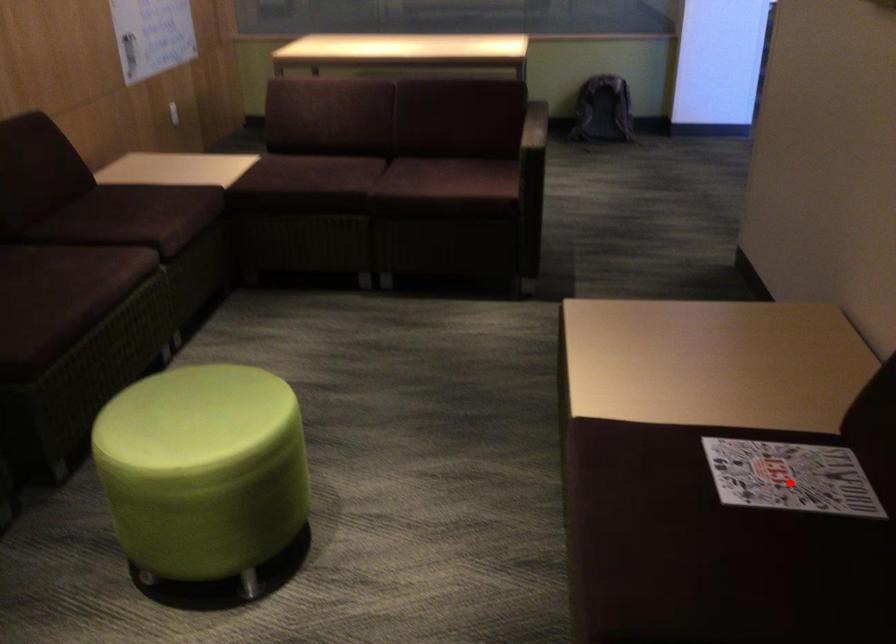
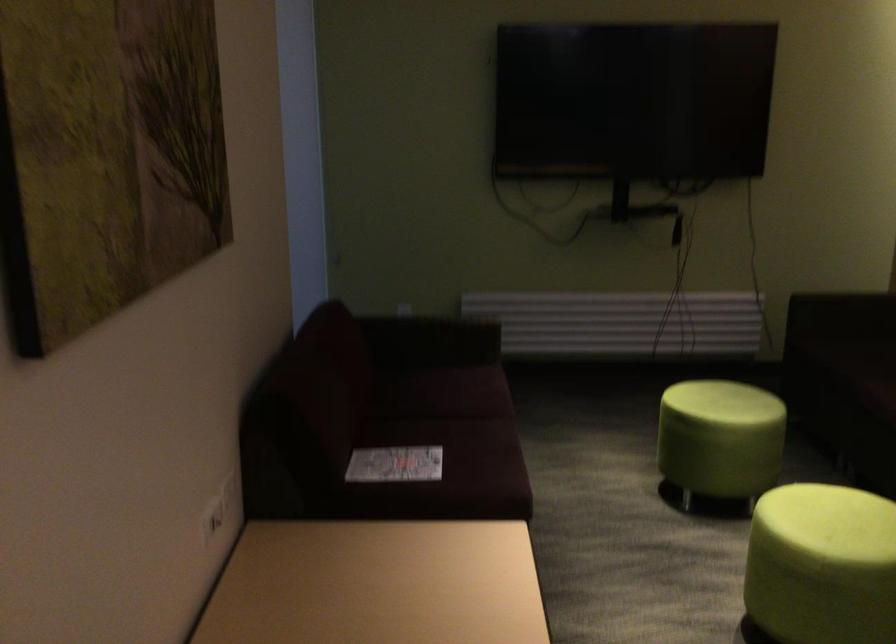
Question: I am providing you with two images of the same scene from different viewpoints. A red point is shown in image1. For the corresponding object point in image2, is it positioned nearer or farther from the camera?

Choices:
 (A) Nearer
 (B) Farther

Answer: (B)